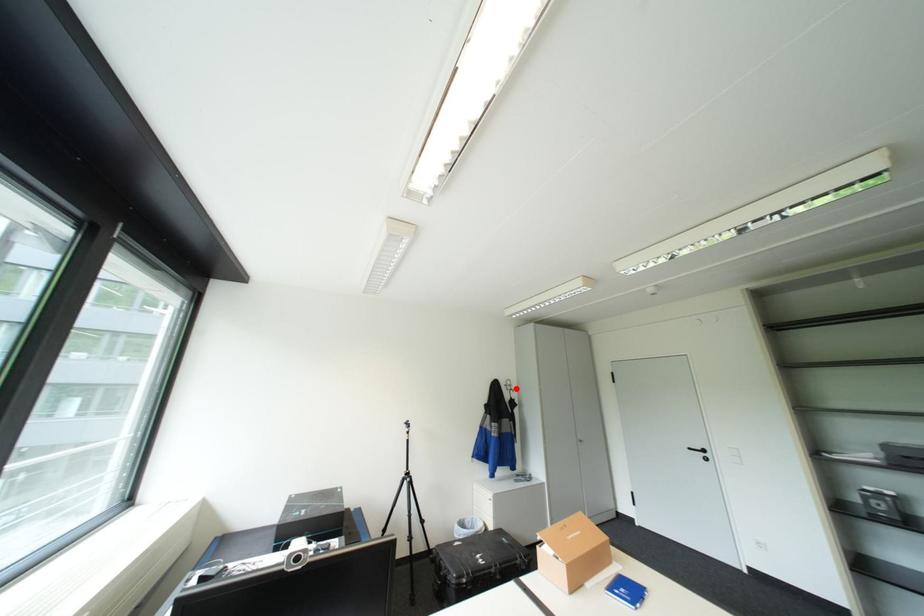
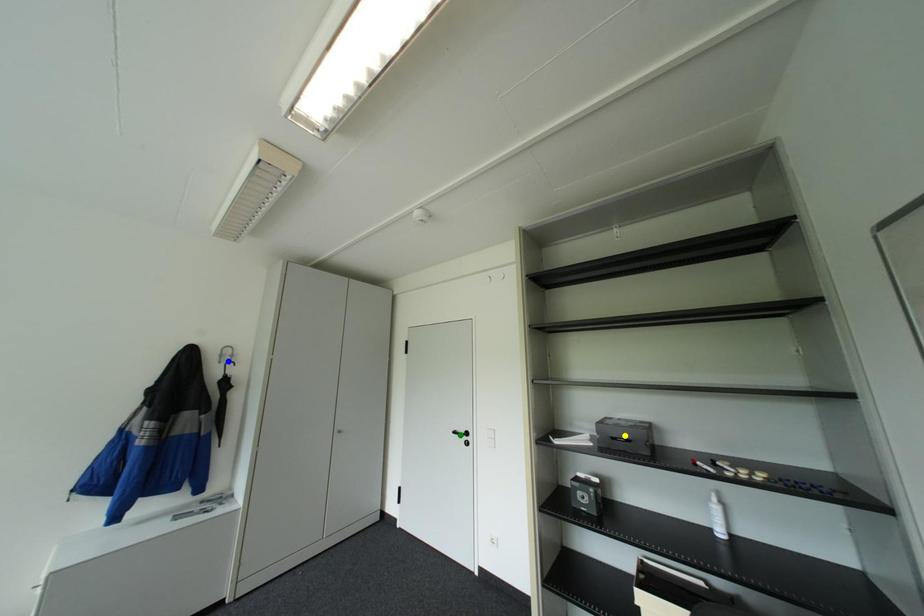
Question: I am providing you with two images of the same scene from different viewpoints. A red point is marked on the first image. You are given multiple points on the second image. Which point in image 2 represents the same 3d spot as the red point in image 1?

Choices:
 (A) green point
 (B) blue point
 (C) yellow point

Answer: (B)